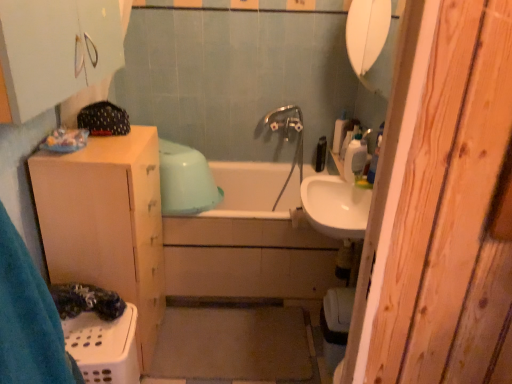
Question: From a real-world perspective, is white plastic container at upper right, marked as the 3th toiletry in a back-to-front arrangement, above or below white glossy sink at center?

Choices:
 (A) below
 (B) above

Answer: (B)

Question: In terms of size, does white plastic container at upper right, marked as the 3th toiletry in a back-to-front arrangement, appear bigger or smaller than white glossy sink at center?

Choices:
 (A) small
 (B) big

Answer: (A)

Question: Considering the real-world distances, which object is closest to the white plastic bottle at upper right, which ranks as the second toiletry in back-to-front order?

Choices:
 (A) black plastic bottle at upper center, the third toiletry viewed from the front
 (B) white plastic soap dispenser at upper right
 (C) white plastic container at upper right, the 1th toiletry positioned from the front
 (D) white matte cabinet at upper left
 (E) white ceramic bathtub at center

Answer: (C)

Question: Which is farther from the white plastic soap dispenser at upper right?

Choices:
 (A) white plastic laundry basket at lower left
 (B) white ceramic bathtub at center
 (C) white glossy sink at center
 (D) chrome metallic faucet at center
 (E) white plastic container at upper right, the 1th toiletry positioned from the front

Answer: (A)